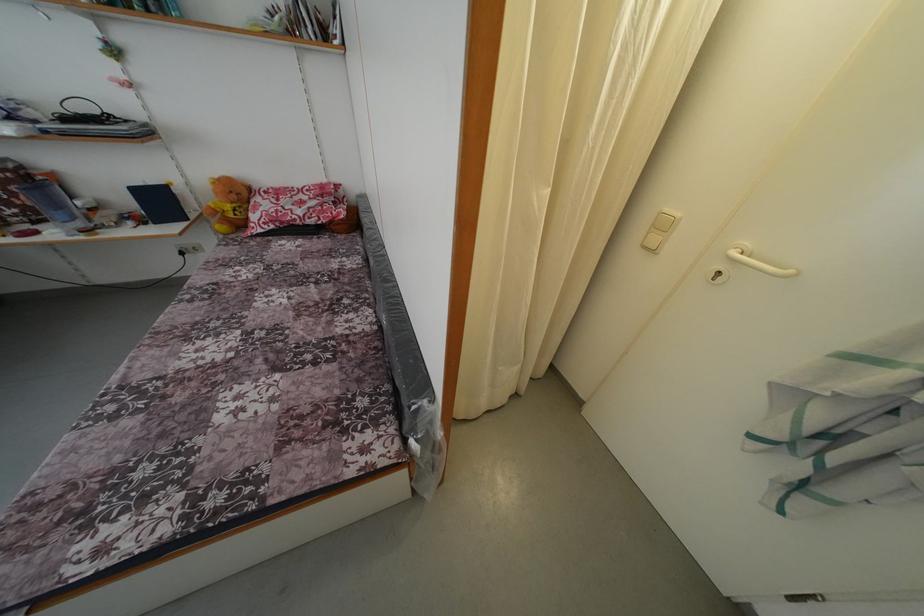
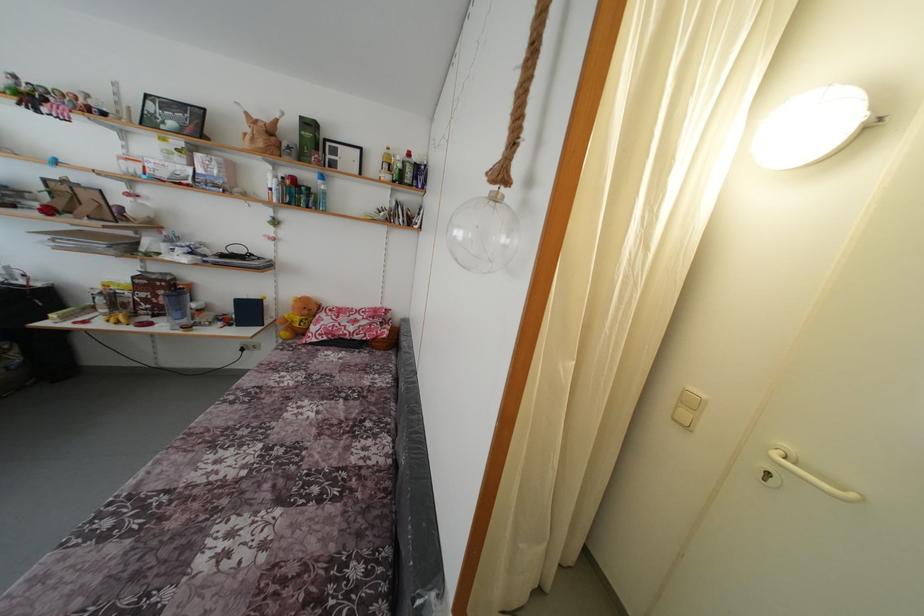
Which direction would the cameraman need to move to produce the second image?

The movement direction of the cameraman is left, backward.